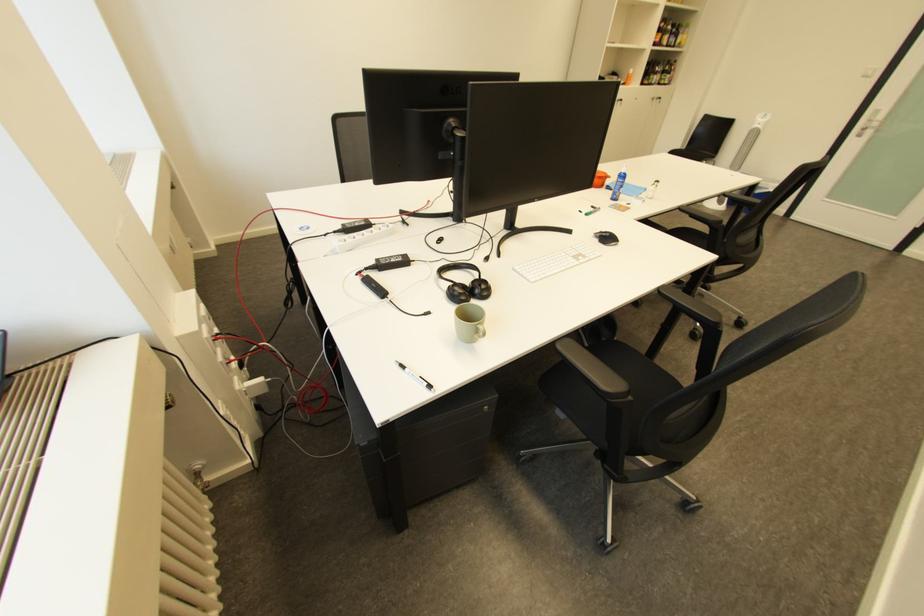
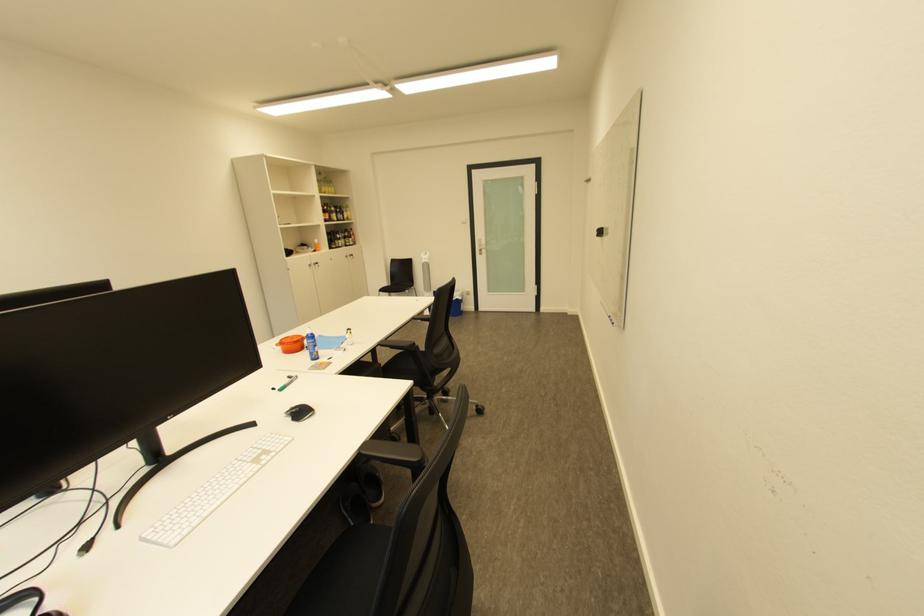
Where in the second image is the point corresponding to point 608,232 from the first image?

(298, 410)